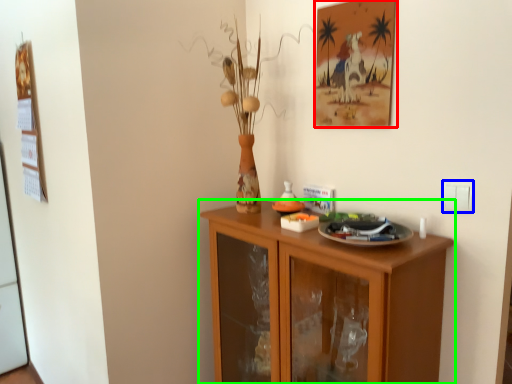
Question: Which object is positioned farthest from picture frame (highlighted by a red box)? Select from electric outlet (highlighted by a blue box) and cabinetry (highlighted by a green box).

Choices:
 (A) electric outlet
 (B) cabinetry

Answer: (B)